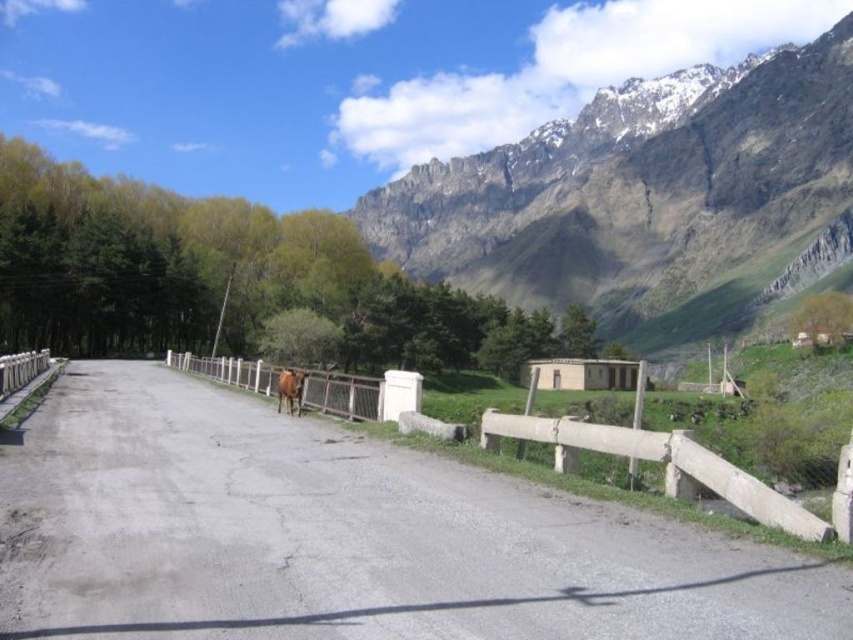
You are standing at the origin point of the image coordinate system. You want to walk to the gray asphalt road at center. Which direction should you move in terms of x and y coordinates?

To reach the gray asphalt road at center located at coordinates point (341,536), you should move in the positive x and positive y direction since the road is at higher x and y coordinates than the origin.

Based on the photo, you are a hiker standing at the rugged stone mountain at upper right and want to cross to the gray asphalt road at center. Which direction should you head to reach the road?

To reach the gray asphalt road at center from the rugged stone mountain at upper right, you should head to the left since the gray asphalt road at center is positioned to the left of the rugged stone mountain at upper right.

You are driving a car and see the gray asphalt road at center and the brown glossy horse at center. Which one is larger in size?

The gray asphalt road at center is bigger than brown glossy horse at center.